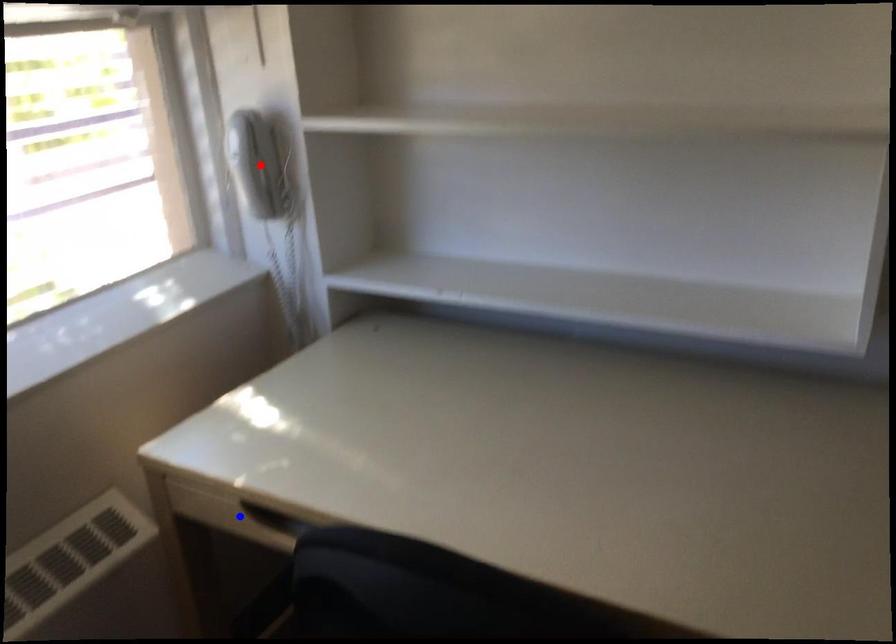
Question: In the image, two points are highlighted. Which point is nearer to the camera? Reply with the corresponding letter.

Choices:
 (A) blue point
 (B) red point

Answer: (A)